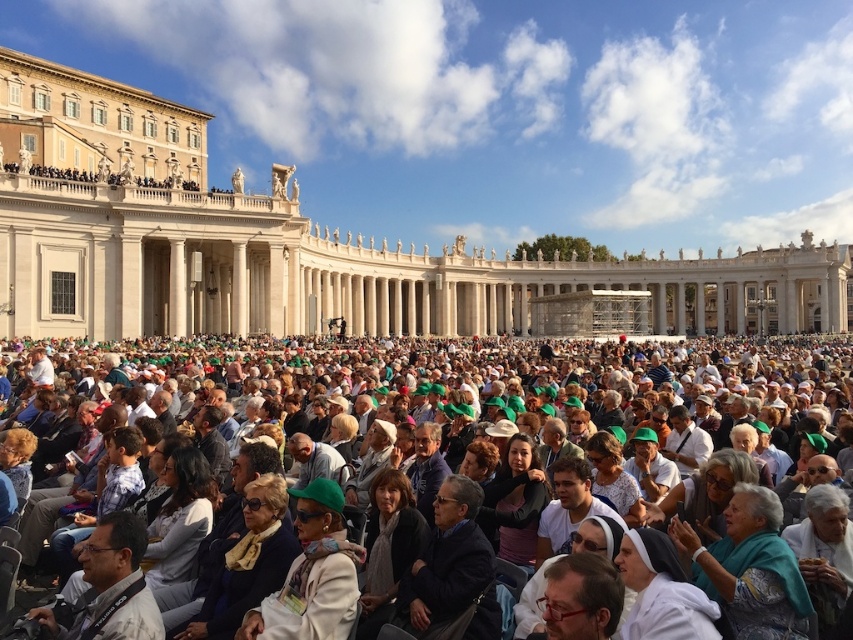
You are standing at the point labeled point (10, 198) in a large public square with a classical building in the background. You want to take a photo of the building using a camera that has a maximum zoom range of 60 meters. Will you be able to capture the entire classical building in your photo from your current position?

The point labeled point (10, 198) is 70.10 meters away from the camera. Since the camera can only zoom up to 60 meters, you will not be able to capture the entire classical building in your photo from your current position.

You are a photographer trying to capture a photo of the beige stone palace at center without any obstructions from the green fabric crowd at center. Based on the scene, can you see the palace clearly?

The beige stone palace at center is above the green fabric crowd at center, so yes, you can see the palace clearly as it is positioned higher than the crowd.

You are an architect designing a new public square and want to ensure there is enough space for both the main building and the crowd. Given the beige stone palace at center and the green fabric crowd at center in the image, which one has a greater width?

The beige stone palace at center has a greater width than the green fabric crowd at center.